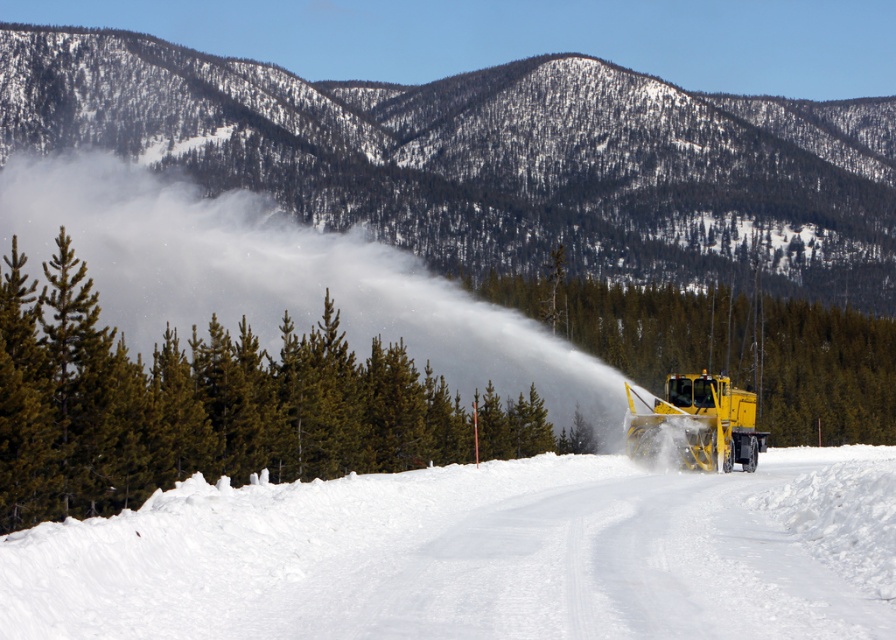
You are a photographer trying to capture both the snowy forested mountain at upper center and the green textured pine at center in a single frame. Given their sizes, which object will occupy more of the photo?

The snowy forested mountain at upper center will occupy more of the photo because its width is larger than the green textured pine at center.

You are a hiker trying to find shelter from the cold wind. You see the white powdery snow at center and the green textured pine at center. Which object can provide better shelter?

The green textured pine at center can provide better shelter because the white powdery snow at center is positioned under it, meaning the pine tree likely offers coverage from the wind.